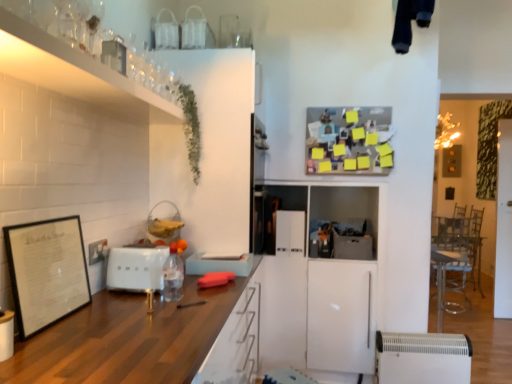
Question: From a real-world perspective, is black matte picture frame at left beneath white plastic heater at lower right, acting as the first appliance starting from the bottom?

Choices:
 (A) no
 (B) yes

Answer: (A)

Question: Does black matte picture frame at left have a greater height compared to white plastic heater at lower right, which is the second appliance in front-to-back order?

Choices:
 (A) no
 (B) yes

Answer: (A)

Question: From a real-world perspective, is black matte picture frame at left positioned over white plastic heater at lower right, which is the second appliance in front-to-back order, based on gravity?

Choices:
 (A) no
 (B) yes

Answer: (B)

Question: Does black matte picture frame at left appear on the right side of white plastic heater at lower right, the 3th appliance in the back-to-front sequence?

Choices:
 (A) yes
 (B) no

Answer: (B)

Question: Is the surface of black matte picture frame at left in direct contact with white plastic heater at lower right, which is the second appliance in front-to-back order?

Choices:
 (A) yes
 (B) no

Answer: (B)

Question: Is black matte picture frame at left positioned with its back to white plastic heater at lower right, which is the fourth appliance from left to right?

Choices:
 (A) no
 (B) yes

Answer: (A)

Question: Is wooden countertop at center, acting as the 2th cabinetry starting from the top, completely or partially outside of green leafy plant at upper left?

Choices:
 (A) yes
 (B) no

Answer: (A)

Question: Is wooden countertop at center, which ranks as the first cabinetry in bottom-to-top order, thinner than green leafy plant at upper left?

Choices:
 (A) no
 (B) yes

Answer: (A)

Question: Would you say green leafy plant at upper left is part of wooden countertop at center, acting as the 2th cabinetry starting from the top,'s contents?

Choices:
 (A) yes
 (B) no

Answer: (B)

Question: Does wooden countertop at center, which ranks as the first cabinetry in bottom-to-top order, have a greater width compared to green leafy plant at upper left?

Choices:
 (A) no
 (B) yes

Answer: (B)

Question: Considering the relative sizes of wooden countertop at center, which ranks as the first cabinetry in bottom-to-top order, and green leafy plant at upper left in the image provided, is wooden countertop at center, which ranks as the first cabinetry in bottom-to-top order, shorter than green leafy plant at upper left?

Choices:
 (A) yes
 (B) no

Answer: (B)

Question: Is wooden countertop at center, which ranks as the first cabinetry in bottom-to-top order, turned away from green leafy plant at upper left?

Choices:
 (A) yes
 (B) no

Answer: (B)

Question: Does wooden countertop at center, which ranks as the first cabinetry in bottom-to-top order, have a smaller size compared to clear plastic bottle at center?

Choices:
 (A) no
 (B) yes

Answer: (A)